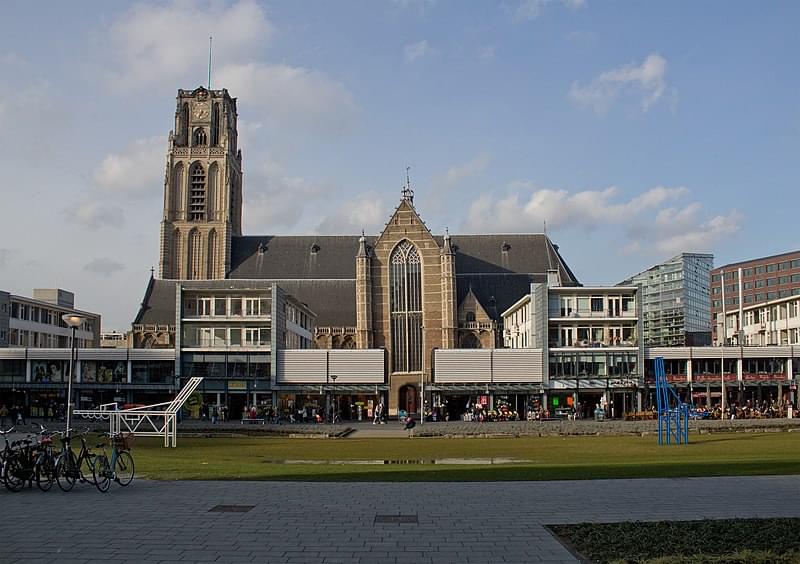
Where is `grey tile`? This screenshot has width=800, height=564. grey tile is located at coordinates (238, 506).